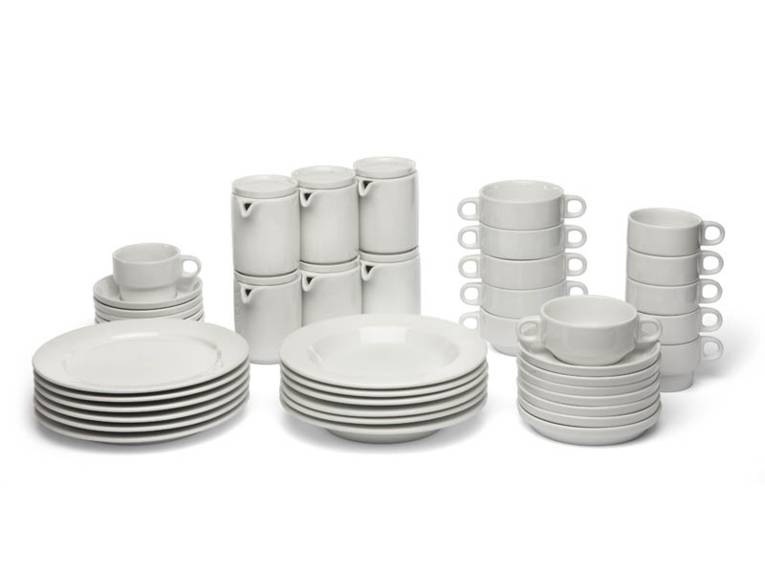
Find the location of a particular element. This screenshot has width=765, height=574. saucers is located at coordinates (578, 437), (578, 420), (612, 409), (617, 398), (597, 391), (604, 383), (610, 369).